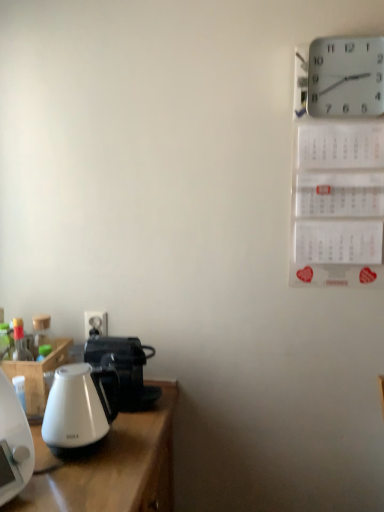
Question: Is white glossy coffee pot at lower left in front of or behind white plastic wall clock at upper right in the image?

Choices:
 (A) behind
 (B) front

Answer: (A)

Question: Is white glossy coffee pot at lower left wider or thinner than white plastic wall clock at upper right?

Choices:
 (A) wide
 (B) thin

Answer: (A)

Question: Which object is positioned closest to the white plastic electric outlet at lower left?

Choices:
 (A) white plastic wall clock at upper right
 (B) white glossy coffee pot at lower left
 (C) white glossy kettle at left

Answer: (B)

Question: Which object is positioned closest to the white plastic electric outlet at lower left?

Choices:
 (A) white glossy kettle at left
 (B) white glossy coffee pot at lower left
 (C) white plastic wall clock at upper right

Answer: (B)